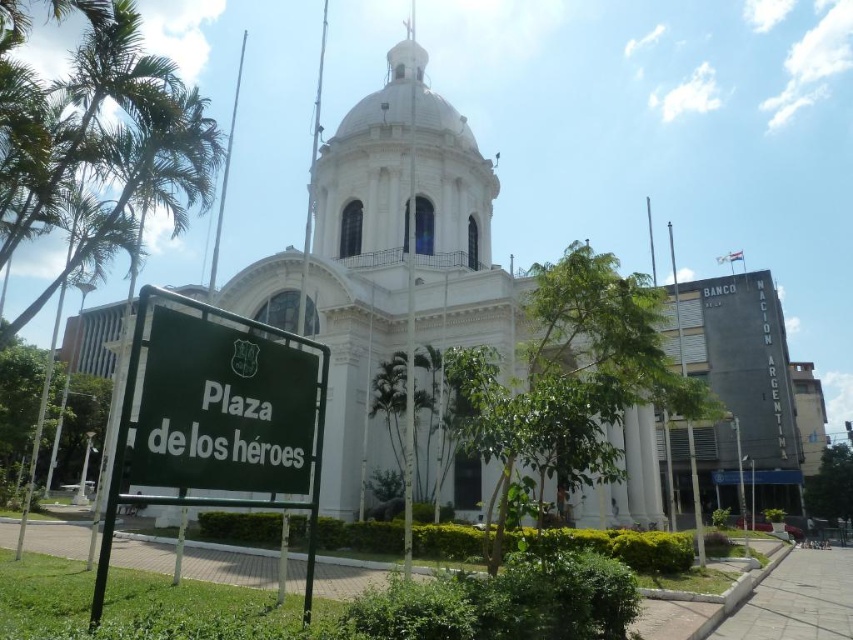
Who is more forward, (386, 138) or (131, 480)?

Point (131, 480)

Who is lower down, white marble church at center or green matte sign at lower left?

Positioned lower is green matte sign at lower left.

Locate an element on the screen. This screenshot has width=853, height=640. white marble church at center is located at coordinates (386, 257).

Looking at this image, who is taller, white marble church at center or green metal/plastic sign at lower left?

Standing taller between the two is white marble church at center.

Looking at this image, measure the distance between white marble church at center and green metal/plastic sign at lower left.

white marble church at center and green metal/plastic sign at lower left are 39.86 meters apart.

Identify the location of white marble church at center. The height and width of the screenshot is (640, 853). (386, 257).

The width and height of the screenshot is (853, 640). Find the location of `green metal/plastic sign at lower left`. green metal/plastic sign at lower left is located at coordinates (218, 417).

Does point (100, 605) lie behind point (196, 451)?

No, it is in front of (196, 451).

The height and width of the screenshot is (640, 853). Describe the element at coordinates (218, 417) in the screenshot. I see `green metal/plastic sign at lower left` at that location.

Find the location of a particular element. This screenshot has width=853, height=640. green metal/plastic sign at lower left is located at coordinates (218, 417).